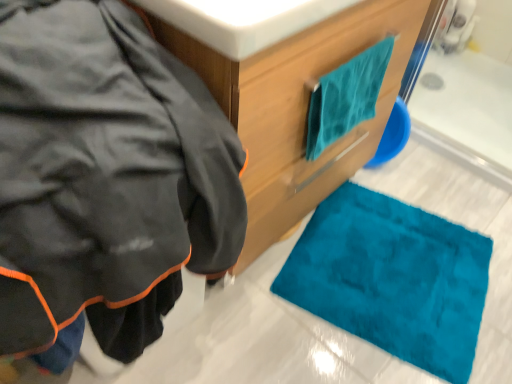
Question: Is matte black jacket at left in front of or behind white glossy sink at upper center in the image?

Choices:
 (A) behind
 (B) front

Answer: (B)

Question: Looking at their shapes, would you say matte black jacket at left is wider or thinner than white glossy sink at upper center?

Choices:
 (A) wide
 (B) thin

Answer: (A)

Question: Based on their relative distances, which object is farther from the teal soft towel at upper right?

Choices:
 (A) white glossy sink at upper center
 (B) matte black jacket at left
 (C) teal fabric towel at upper right

Answer: (B)

Question: Which object is the farthest from the matte black jacket at left?

Choices:
 (A) teal fabric towel at upper right
 (B) white glossy sink at upper center
 (C) teal soft towel at upper right

Answer: (C)